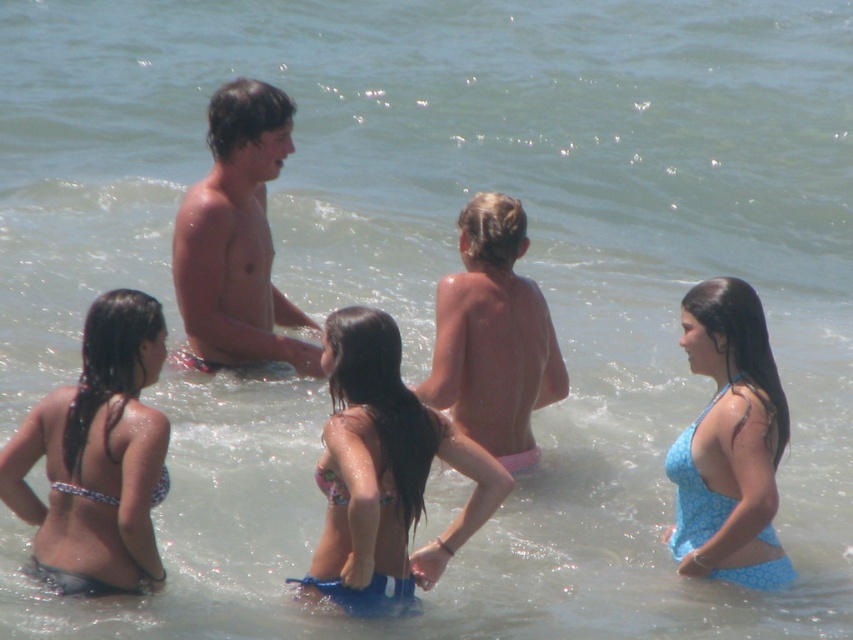
Between printed fabric bikini at lower left and blue fabric swimsuit at center, which one is positioned lower?

blue fabric swimsuit at center is below.

Where is `printed fabric bikini at lower left`? printed fabric bikini at lower left is located at coordinates (97, 456).

Locate an element on the screen. This screenshot has height=640, width=853. printed fabric bikini at lower left is located at coordinates (97, 456).

What do you see at coordinates (236, 237) in the screenshot?
I see `smooth skin boy at center` at bounding box center [236, 237].

Does smooth skin boy at center have a larger size compared to pink fabric boy at center?

Yes, smooth skin boy at center is bigger than pink fabric boy at center.

Does point (277, 304) come behind point (469, 227)?

Yes, point (277, 304) is farther from viewer.

Locate an element on the screen. smooth skin boy at center is located at coordinates (236, 237).

Does blue fabric swimsuit at center have a lesser height compared to blue printed swimsuit at center?

Correct, blue fabric swimsuit at center is not as tall as blue printed swimsuit at center.

Does blue fabric swimsuit at center have a greater width compared to blue printed swimsuit at center?

Correct, the width of blue fabric swimsuit at center exceeds that of blue printed swimsuit at center.

Is point (421, 499) less distant than point (766, 564)?

Yes, it is in front of point (766, 564).

At what (x,y) coordinates should I click in order to perform the action: click on blue fabric swimsuit at center. Please return your answer as a coordinate pair (x, y). The height and width of the screenshot is (640, 853). Looking at the image, I should click on pos(384,472).